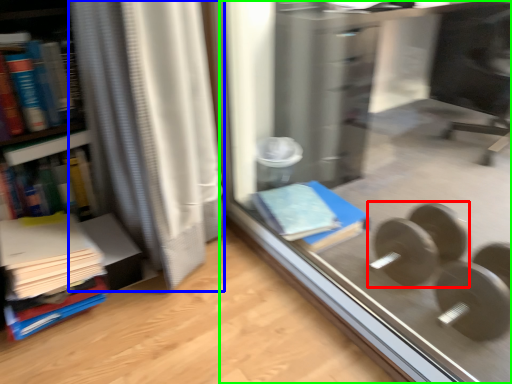
Question: Which is farther away from dumbbell (highlighted by a red box)? curtain (highlighted by a blue box) or glass door (highlighted by a green box)?

Choices:
 (A) curtain
 (B) glass door

Answer: (A)